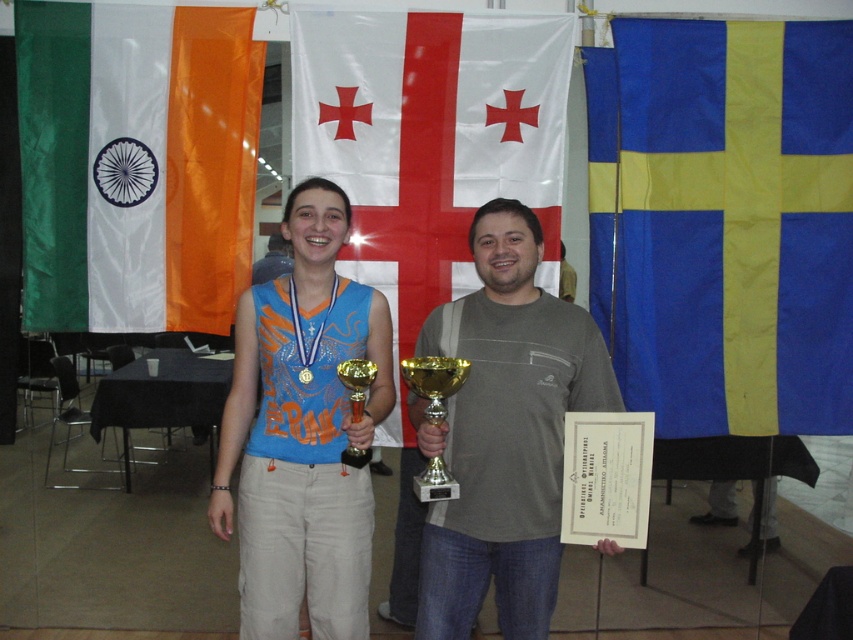
Question: Does gray matte t-shirt at center have a smaller size compared to gold metallic trophy at center?

Choices:
 (A) yes
 (B) no

Answer: (B)

Question: Among these objects, which one is nearest to the camera?

Choices:
 (A) greensilky fabricflag at left
 (B) blue/yellow fabric flag at right
 (C) gold metallic medal at center

Answer: (C)

Question: Can you confirm if blue/yellow fabric flag at right is bigger than whiteflag at center?

Choices:
 (A) yes
 (B) no

Answer: (B)

Question: Which point appears farthest from the camera in this image?

Choices:
 (A) (415, 392)
 (B) (665, 125)

Answer: (B)

Question: Where is matte blue tank top at center located in relation to gold metallic medal at center in the image?

Choices:
 (A) above
 (B) below

Answer: (B)

Question: Which object is closer to the camera taking this photo?

Choices:
 (A) gray matte t-shirt at center
 (B) whiteflag at center

Answer: (A)